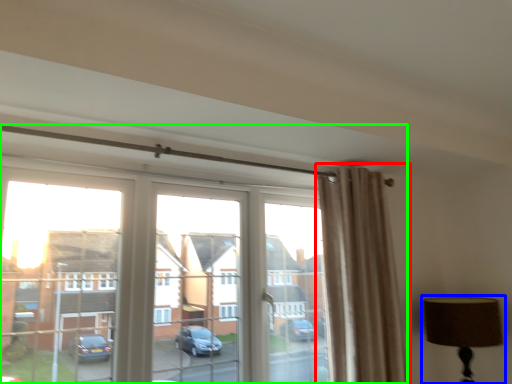
Question: Based on their relative distances, which object is nearer to curtain (highlighted by a red box)? Choose from table lamp (highlighted by a blue box) and window (highlighted by a green box).

Choices:
 (A) table lamp
 (B) window

Answer: (A)